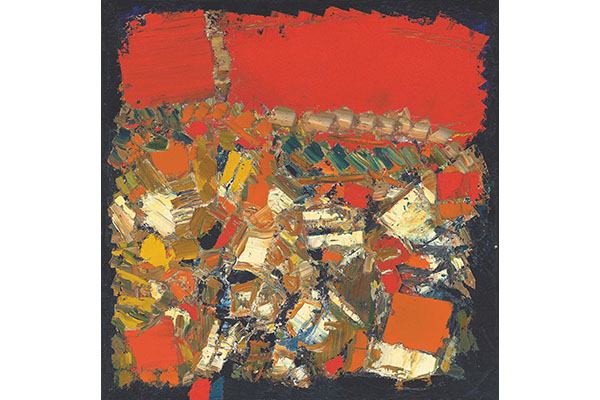
This screenshot has width=600, height=400. Identify the location of top of painting. (312, 10).